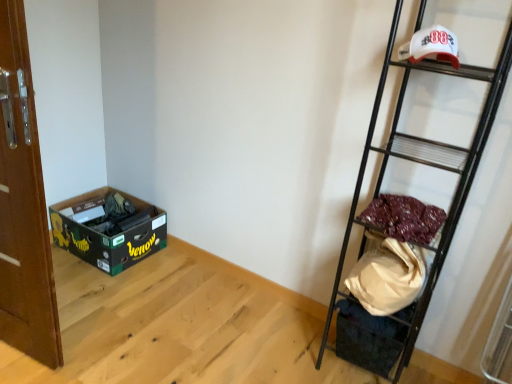
Locate an element on the screen. The image size is (512, 384). free space that is in between brown wooden door at left and black metal ladder at right is located at coordinates (189, 348).